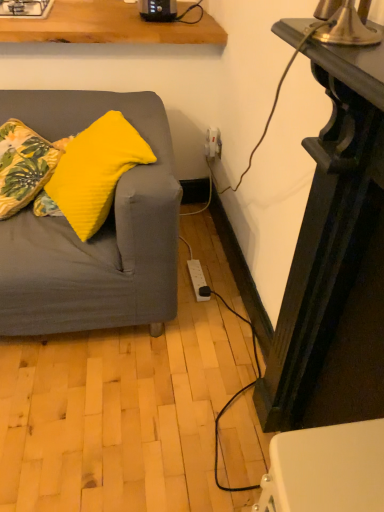
Where is `free spot in front of black plastic toaster at upper center`? free spot in front of black plastic toaster at upper center is located at coordinates (157, 24).